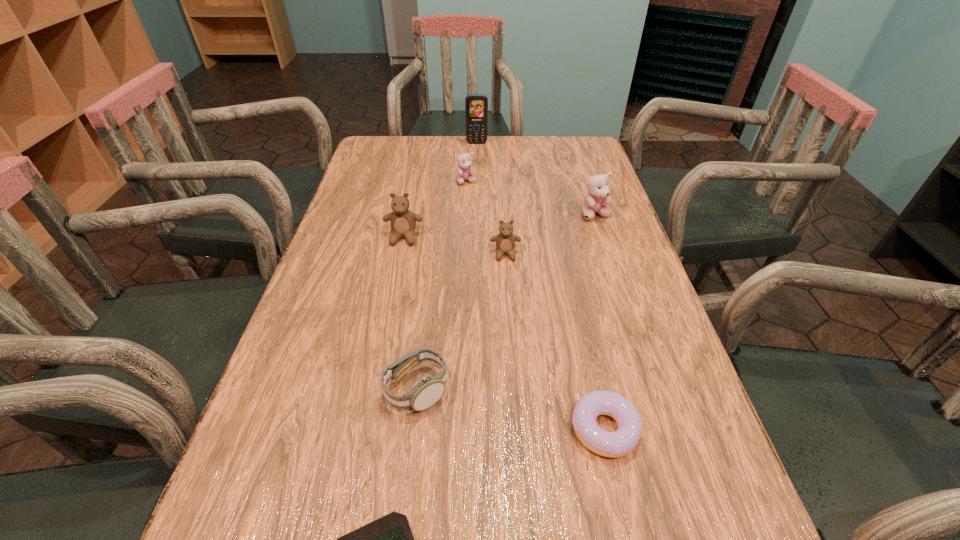
At what (x,y) coordinates should I click in order to perform the action: click on watch. Please return your answer as a coordinate pair (x, y). This screenshot has height=540, width=960. Looking at the image, I should click on (429, 390).

Where is `white watch`? This screenshot has width=960, height=540. white watch is located at coordinates (429, 390).

Find the location of `the seventh tallest object`. the seventh tallest object is located at coordinates (613, 444).

This screenshot has height=540, width=960. What are the coordinates of `the second object from right to left` in the screenshot? It's located at (613, 444).

This screenshot has width=960, height=540. Identify the location of free location located on the screen of the tallest object. (476, 167).

At what (x,y) coordinates should I click in order to perform the action: click on vacant point located on the front-facing side of the bigger brown teddy bear. Please return your answer as a coordinate pair (x, y). This screenshot has height=540, width=960. Looking at the image, I should click on (379, 356).

The height and width of the screenshot is (540, 960). I want to click on free location located 0.290m at the face of the rightmost teddy bear, so click(625, 303).

The height and width of the screenshot is (540, 960). I want to click on free spot located 0.220m on the front-facing side of the third teddy bear from left to right, so click(511, 334).

Where is `vacant space located at the face of the seventh nearest object`? vacant space located at the face of the seventh nearest object is located at coordinates (464, 255).

Identify the location of vacant space situated on the face of the sixth tallest object. The image size is (960, 540). (564, 390).